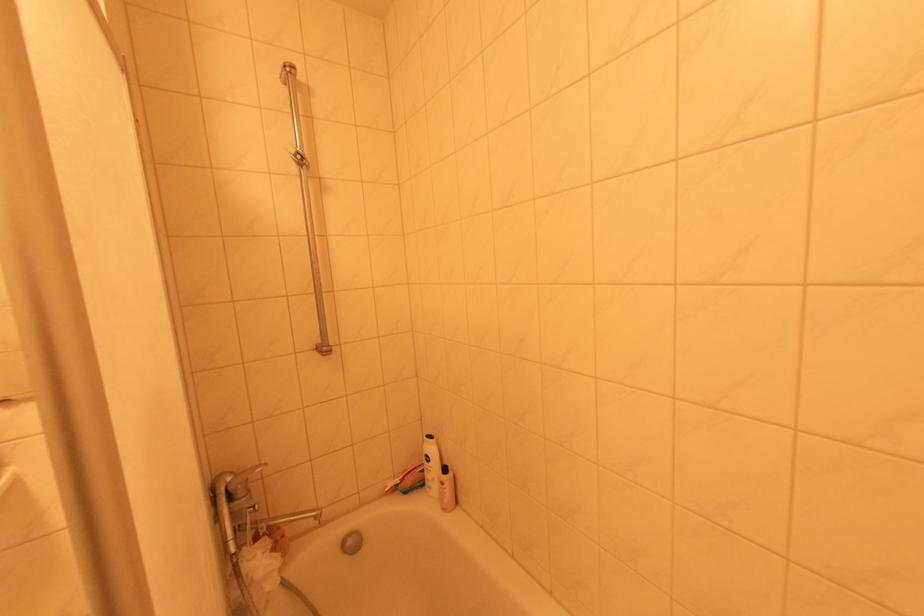
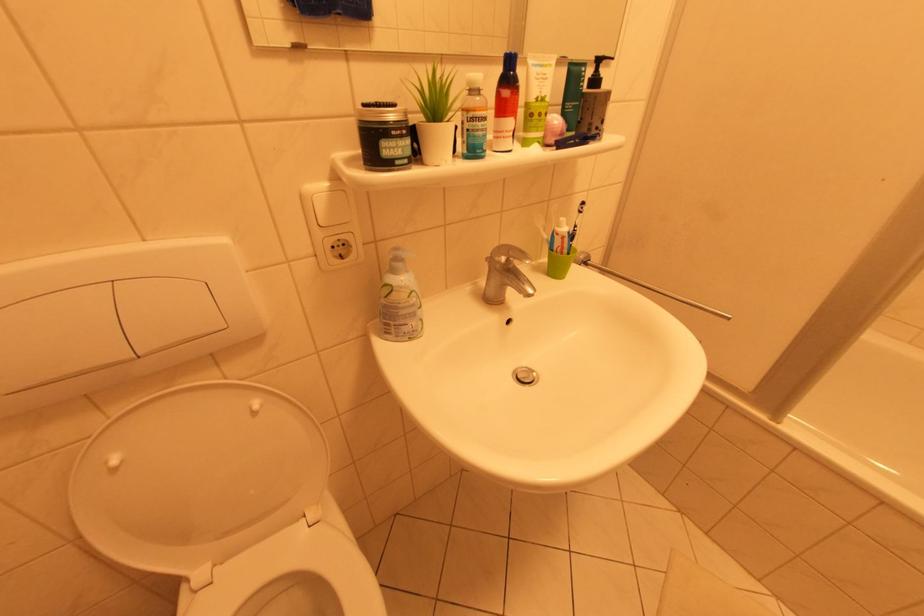
Question: What movement of the cameraman would produce the second image?

Choices:
 (A) Left
 (B) Right
 (C) Forward
 (D) Backward

Answer: (A)